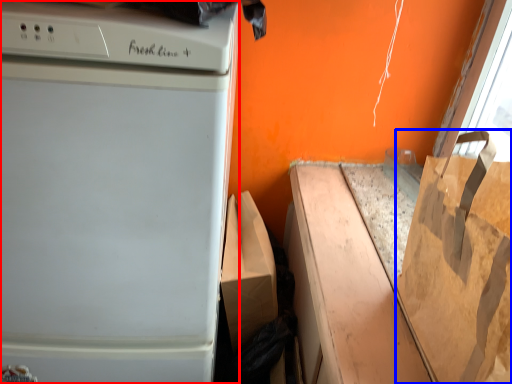
Question: Which object is closer to the camera taking this photo, home appliance (highlighted by a red box) or grocery bag (highlighted by a blue box)?

Choices:
 (A) home appliance
 (B) grocery bag

Answer: (B)